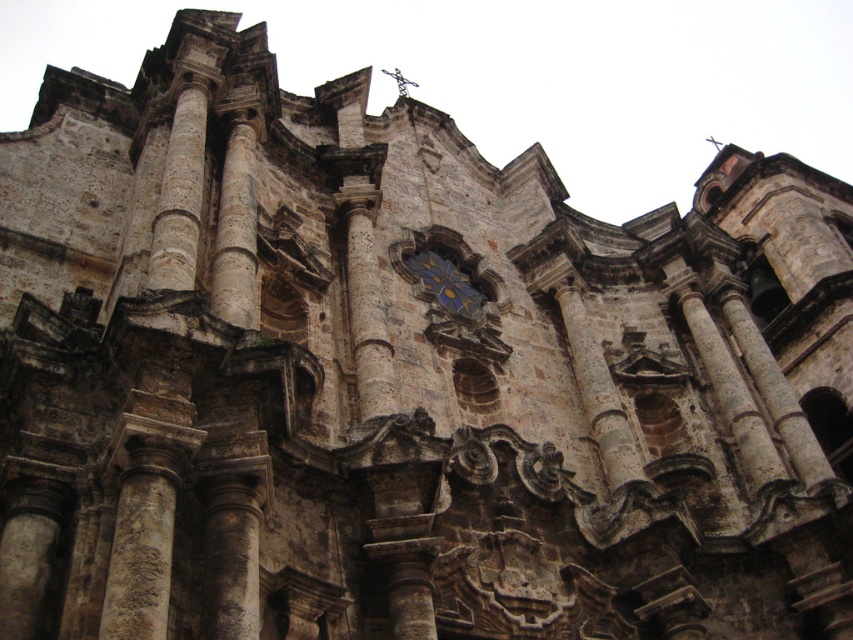
Question: Which point appears farthest from the camera in this image?

Choices:
 (A) (438, 289)
 (B) (152, 241)

Answer: (A)

Question: Does stone column at center have a lesser width compared to blue glass mosaic at center?

Choices:
 (A) yes
 (B) no

Answer: (A)

Question: In this image, where is stone column at center located relative to blue glass mosaic at center?

Choices:
 (A) right
 (B) left

Answer: (B)

Question: Can you confirm if stone column at center is positioned below blue glass mosaic at center?

Choices:
 (A) yes
 (B) no

Answer: (B)